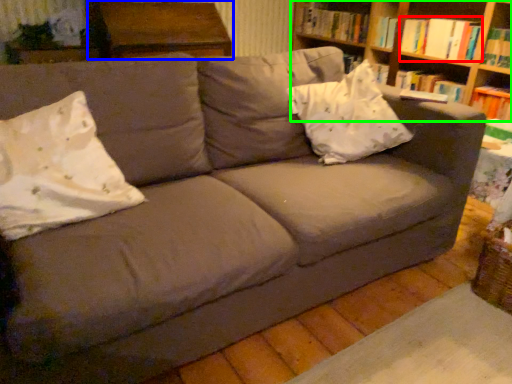
Question: Which is farther away from book (highlighted by a red box)? table (highlighted by a blue box) or shelf (highlighted by a green box)?

Choices:
 (A) table
 (B) shelf

Answer: (A)